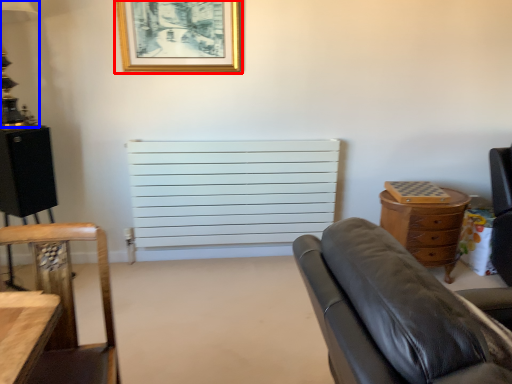
Question: Which object appears closest to the camera in this image, picture frame (highlighted by a red box) or lamp (highlighted by a blue box)?

Choices:
 (A) picture frame
 (B) lamp

Answer: (B)